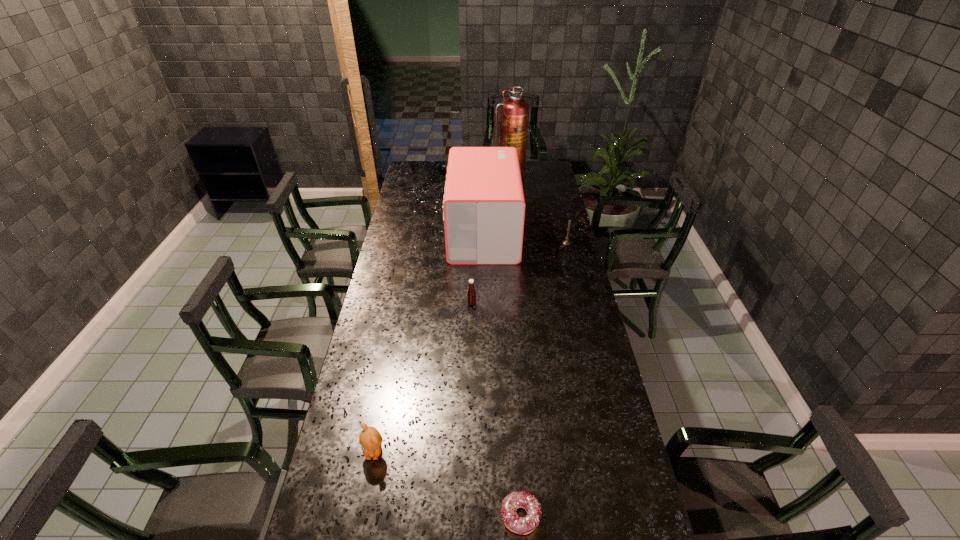
I want to click on free space at the left edge of the desktop, so click(375, 293).

Identify the location of free space at the right edge of the desktop. (592, 403).

Where is `empty space between the second tallest object and the rightmost object`? This screenshot has width=960, height=540. empty space between the second tallest object and the rightmost object is located at coordinates click(x=525, y=238).

The height and width of the screenshot is (540, 960). In order to click on vacant area that lies between the Tabasco sauce and the box in this screenshot , I will do `click(477, 268)`.

Image resolution: width=960 pixels, height=540 pixels. I want to click on vacant space in between the candle and the third nearest object, so click(519, 273).

The height and width of the screenshot is (540, 960). Identify the location of vacant region between the Tabasco sauce and the candle. (519, 273).

The width and height of the screenshot is (960, 540). I want to click on vacant region between the Tabasco sauce and the rightmost object, so click(519, 273).

The width and height of the screenshot is (960, 540). Find the location of `vacant space that is in between the rightmost object and the leftmost object`. vacant space that is in between the rightmost object and the leftmost object is located at coordinates (470, 347).

This screenshot has width=960, height=540. I want to click on free space between the rightmost object and the Tabasco sauce, so click(519, 273).

Where is `vacant space that is in between the rightmost object and the second tallest object`? The width and height of the screenshot is (960, 540). vacant space that is in between the rightmost object and the second tallest object is located at coordinates (525, 238).